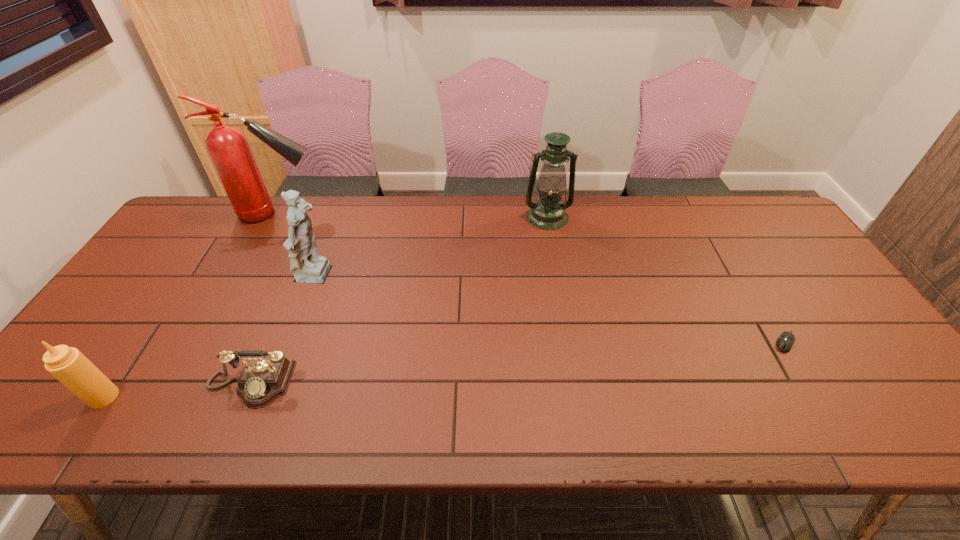
At what (x,y) coordinates should I click in order to perform the action: click on vacant space at the far edge. Please return your answer as a coordinate pair (x, y). Looking at the image, I should click on coord(566,225).

Find the location of `free space at the near edge of the desktop`. free space at the near edge of the desktop is located at coordinates (x=111, y=432).

The image size is (960, 540). What are the coordinates of `vacant point at the right edge` in the screenshot? It's located at (833, 322).

Image resolution: width=960 pixels, height=540 pixels. Find the location of `free point between the second shortest object and the tallest object`. free point between the second shortest object and the tallest object is located at coordinates (265, 299).

Locate an element on the screen. blank region between the third farthest object and the oil lamp is located at coordinates (432, 247).

At what (x,y) coordinates should I click in order to perform the action: click on vacant space that is in between the fifth tallest object and the oil lamp. Please return your answer as a coordinate pair (x, y). The image size is (960, 540). Looking at the image, I should click on (399, 301).

Image resolution: width=960 pixels, height=540 pixels. In order to click on free spot between the figurine and the condiment in this screenshot , I will do `click(210, 338)`.

Find the location of a particular element. The height and width of the screenshot is (540, 960). vacant space that is in between the condiment and the shortest object is located at coordinates (444, 370).

Identify the location of vacant area that lies between the telephone and the oil lamp. Image resolution: width=960 pixels, height=540 pixels. (399, 301).

Find the location of `unoccupied position between the telephone and the computer mouse`. unoccupied position between the telephone and the computer mouse is located at coordinates (518, 363).